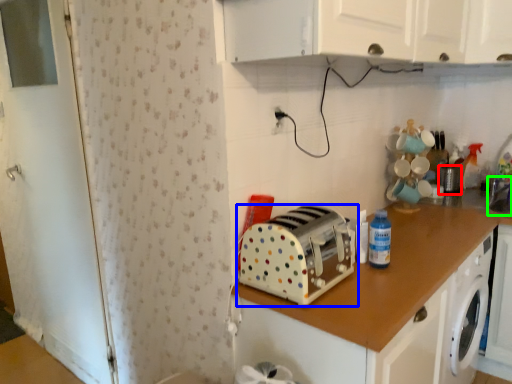
Question: Which object is the closest to the appliance (highlighted by a red box)? Choose among these: toaster (highlighted by a blue box) or sink (highlighted by a green box).

Choices:
 (A) toaster
 (B) sink

Answer: (B)